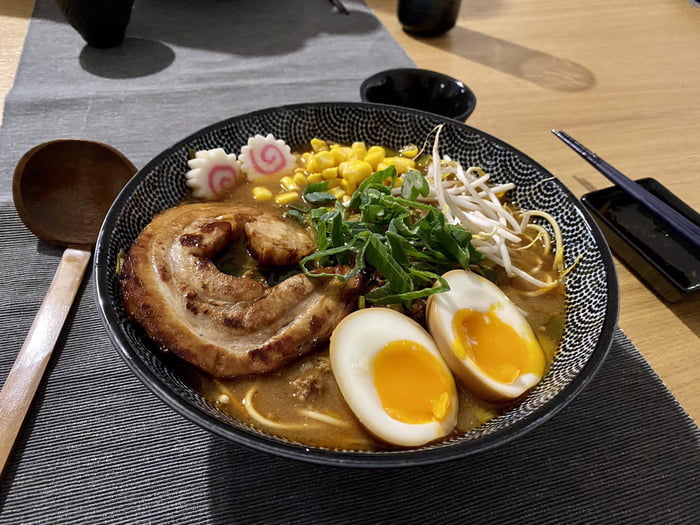
Identify the location of black and white bowl. This screenshot has height=525, width=700. (570, 361).